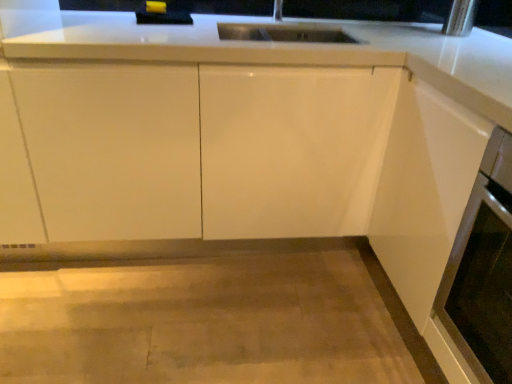
What is the approximate height of satin white oven at lower right?

satin white oven at lower right is 24.91 inches tall.

Where is `satin white oven at lower right`? satin white oven at lower right is located at coordinates (483, 270).

Describe the element at coordinates (483, 270) in the screenshot. I see `satin white oven at lower right` at that location.

The height and width of the screenshot is (384, 512). Find the location of `white glossy cabinet at center`. white glossy cabinet at center is located at coordinates (206, 149).

Describe the element at coordinates (206, 149) in the screenshot. This screenshot has width=512, height=384. I see `white glossy cabinet at center` at that location.

Locate an element on the screen. The width and height of the screenshot is (512, 384). satin white oven at lower right is located at coordinates pos(483,270).

Considering the positions of objects white glossy cabinet at center and satin white oven at lower right in the image provided, who is more to the left, white glossy cabinet at center or satin white oven at lower right?

white glossy cabinet at center is more to the left.

Which object is closer to the camera, white glossy cabinet at center or satin white oven at lower right?

satin white oven at lower right is more forward.

Is point (123, 108) less distant than point (490, 252)?

No, (123, 108) is behind (490, 252).

From the image's perspective, is white glossy cabinet at center above or below satin white oven at lower right?

Clearly, from the image's perspective, white glossy cabinet at center is above satin white oven at lower right.

From a real-world perspective, is white glossy cabinet at center physically located above or below satin white oven at lower right?

From a real-world perspective, white glossy cabinet at center is physically below satin white oven at lower right.

Looking at their sizes, would you say white glossy cabinet at center is wider or thinner than satin white oven at lower right?

In the image, white glossy cabinet at center appears to be wider than satin white oven at lower right.

Does white glossy cabinet at center have a greater height compared to satin white oven at lower right?

Indeed, white glossy cabinet at center has a greater height compared to satin white oven at lower right.

Is white glossy cabinet at center smaller than satin white oven at lower right?

Incorrect, white glossy cabinet at center is not smaller in size than satin white oven at lower right.

Which is correct: white glossy cabinet at center is inside satin white oven at lower right, or outside of it?

white glossy cabinet at center is not inside satin white oven at lower right, it's outside.

Is white glossy cabinet at center next to satin white oven at lower right?

There is a gap between white glossy cabinet at center and satin white oven at lower right.

Is satin white oven at lower right at the back of white glossy cabinet at center?

No, satin white oven at lower right is not at the back of white glossy cabinet at center.

How many degrees apart are the facing directions of white glossy cabinet at center and satin white oven at lower right?

There is a 90-degree angle between the facing directions of white glossy cabinet at center and satin white oven at lower right.

Measure the distance between white glossy cabinet at center and satin white oven at lower right.

white glossy cabinet at center is 32.31 inches away from satin white oven at lower right.

In the image, there is a satin white oven at lower right. Identify the location of cabinetry below it (from a real-world perspective). (206, 149).

Which object is positioned more to the right, satin white oven at lower right or white glossy cabinet at center?

Positioned to the right is satin white oven at lower right.

Is satin white oven at lower right further to camera compared to white glossy cabinet at center?

No, it is in front of white glossy cabinet at center.

Is point (464, 306) farther from viewer compared to point (158, 184)?

No.

From the image's perspective, is satin white oven at lower right on top of white glossy cabinet at center?

No, from the image's perspective, satin white oven at lower right is not above white glossy cabinet at center.

From a real-world perspective, is satin white oven at lower right positioned over white glossy cabinet at center based on gravity?

Correct, in the physical world, satin white oven at lower right is higher than white glossy cabinet at center.

In terms of width, does satin white oven at lower right look wider or thinner when compared to white glossy cabinet at center?

Considering their sizes, satin white oven at lower right looks slimmer than white glossy cabinet at center.

Can you confirm if satin white oven at lower right is taller than white glossy cabinet at center?

In fact, satin white oven at lower right may be shorter than white glossy cabinet at center.

In the scene shown: In terms of size, does satin white oven at lower right appear bigger or smaller than white glossy cabinet at center?

satin white oven at lower right is smaller than white glossy cabinet at center.

Based on the photo, is satin white oven at lower right situated inside white glossy cabinet at center or outside?

satin white oven at lower right is located beyond the bounds of white glossy cabinet at center.

Is satin white oven at lower right beside white glossy cabinet at center?

satin white oven at lower right is not next to white glossy cabinet at center, and they're not touching.

Is satin white oven at lower right oriented away from white glossy cabinet at center?

satin white oven at lower right does not have its back to white glossy cabinet at center.

Consider the image. Measure the distance from satin white oven at lower right to white glossy cabinet at center.

32.31 inches.

Identify the location of cabinetry on the left of satin white oven at lower right. (206, 149).

At what (x,y) coordinates should I click in order to perform the action: click on cabinetry above the satin white oven at lower right (from the image's perspective). Please return your answer as a coordinate pair (x, y). Looking at the image, I should click on (206, 149).

Where is `cabinetry behind the satin white oven at lower right`? cabinetry behind the satin white oven at lower right is located at coordinates (206, 149).